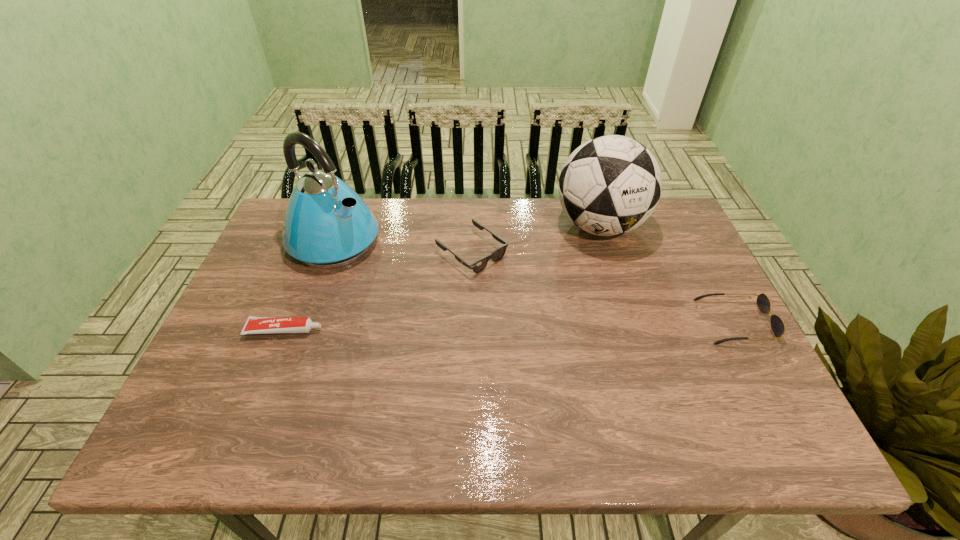
Image resolution: width=960 pixels, height=540 pixels. I want to click on the shortest object, so click(x=254, y=325).

I want to click on the nearer sunglasses, so click(x=778, y=327).

At what (x,y) coordinates should I click in order to perform the action: click on the rightmost object. Please return your answer as a coordinate pair (x, y). Looking at the image, I should click on (778, 327).

Identify the location of the second object from right to left. (610, 185).

Where is `the second tallest object`? the second tallest object is located at coordinates (610, 185).

This screenshot has height=540, width=960. Identify the location of kettle. (327, 224).

The image size is (960, 540). In order to click on the third object from right to left in this screenshot , I will do [x=478, y=266].

You are a GUI agent. You are given a task and a screenshot of the screen. Output one action in this format:
    pyautogui.click(x=<x>, y=<y>)
    Task: Click on the farther sunglasses
    The height and width of the screenshot is (540, 960).
    Given the screenshot: What is the action you would take?
    pyautogui.click(x=478, y=266)

Locate an element on the screen. This screenshot has height=540, width=960. free space located at the nozzle of the toothpaste is located at coordinates (457, 330).

Locate an element on the screen. Image resolution: width=960 pixels, height=540 pixels. free location located on the surface of the fourth object from left to right where the brand logo is visible is located at coordinates (581, 294).